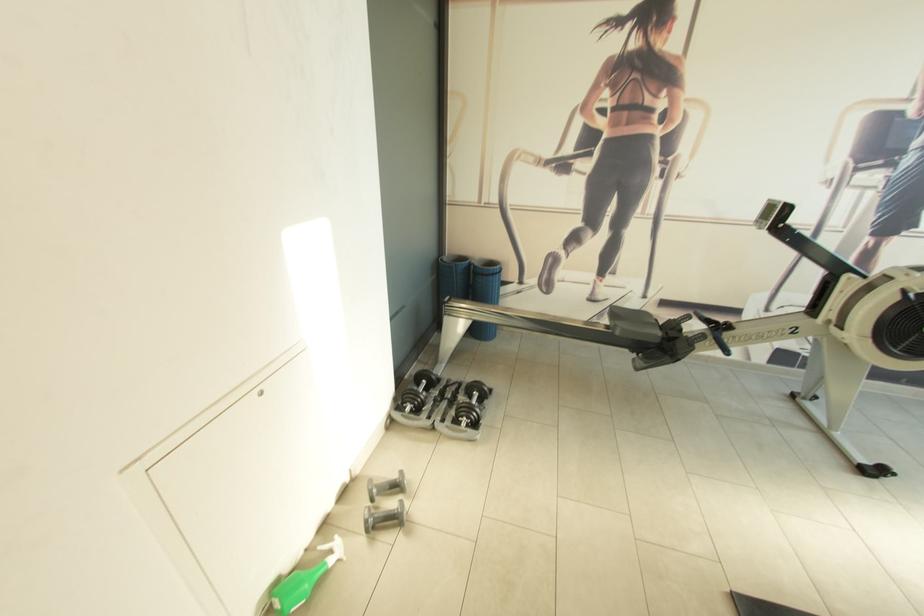
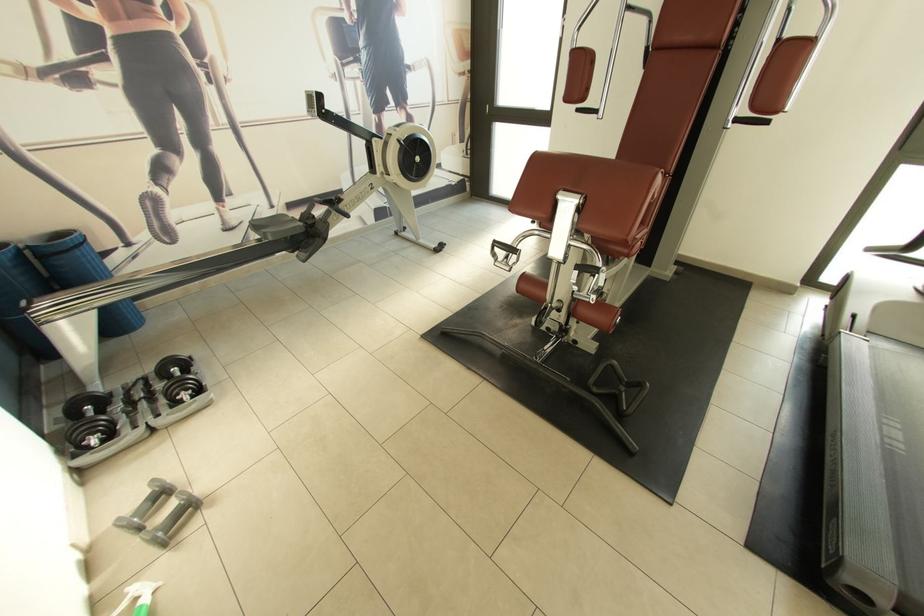
The point at (398, 477) is marked in the first image. Where is the corresponding point in the second image?

(152, 493)